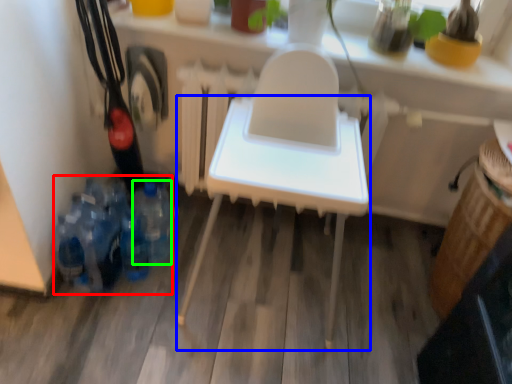
Question: Which object is the closest to the bottle (highlighted by a red box)? Choose among these: furniture (highlighted by a blue box) or bottle (highlighted by a green box).

Choices:
 (A) furniture
 (B) bottle

Answer: (B)